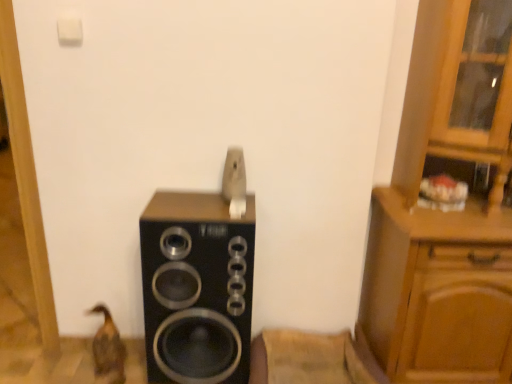
Question: Does brown matte duck at lower left have a lesser width compared to wooden cabinet at right?

Choices:
 (A) no
 (B) yes

Answer: (B)

Question: From a real-world perspective, does brown matte duck at lower left stand above wooden cabinet at right?

Choices:
 (A) yes
 (B) no

Answer: (B)

Question: Is brown matte duck at lower left positioned with its back to wooden cabinet at right?

Choices:
 (A) yes
 (B) no

Answer: (B)

Question: Is brown matte duck at lower left smaller than wooden cabinet at right?

Choices:
 (A) yes
 (B) no

Answer: (A)

Question: Is brown matte duck at lower left to the right of wooden cabinet at right from the viewer's perspective?

Choices:
 (A) no
 (B) yes

Answer: (A)

Question: Is wooden cabinet at right situated inside brown matte duck at lower left or outside?

Choices:
 (A) outside
 (B) inside

Answer: (A)

Question: In terms of width, does wooden cabinet at right look wider or thinner when compared to brown matte duck at lower left?

Choices:
 (A) wide
 (B) thin

Answer: (A)

Question: Is wooden cabinet at right to the left or to the right of brown matte duck at lower left in the image?

Choices:
 (A) left
 (B) right

Answer: (B)

Question: In terms of height, does wooden cabinet at right look taller or shorter compared to brown matte duck at lower left?

Choices:
 (A) tall
 (B) short

Answer: (A)

Question: In the image, is wooden cabinet at right on the left side or the right side of black matte speaker at center?

Choices:
 (A) left
 (B) right

Answer: (B)

Question: Considering their positions, is wooden cabinet at right located in front of or behind black matte speaker at center?

Choices:
 (A) behind
 (B) front

Answer: (B)

Question: Is point (394, 289) positioned closer to the camera than point (152, 221)?

Choices:
 (A) farther
 (B) closer

Answer: (A)

Question: From a real-world perspective, is wooden cabinet at right physically located above or below black matte speaker at center?

Choices:
 (A) above
 (B) below

Answer: (A)

Question: Is brown matte duck at lower left taller or shorter than black matte speaker at center?

Choices:
 (A) tall
 (B) short

Answer: (B)

Question: Considering their positions, is brown matte duck at lower left located in front of or behind black matte speaker at center?

Choices:
 (A) front
 (B) behind

Answer: (B)